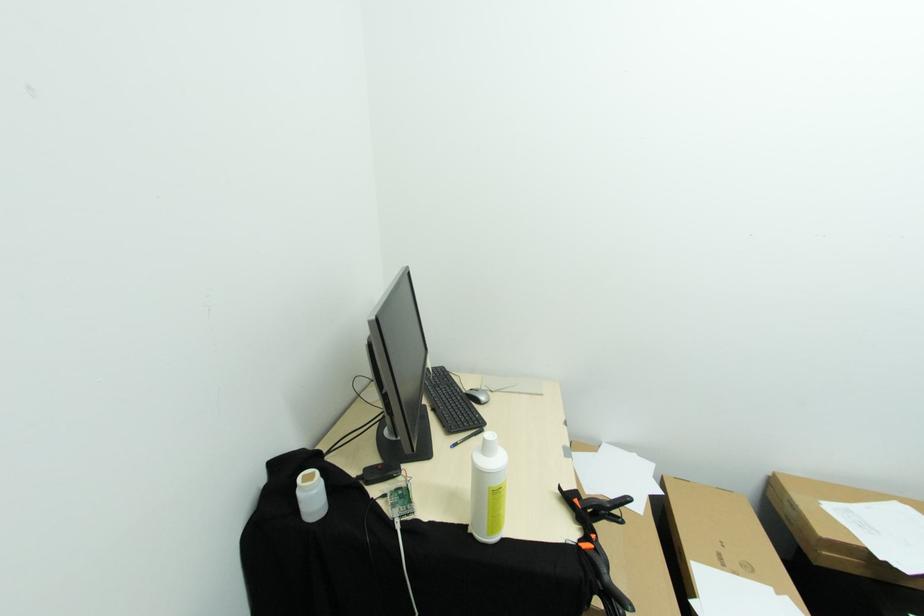
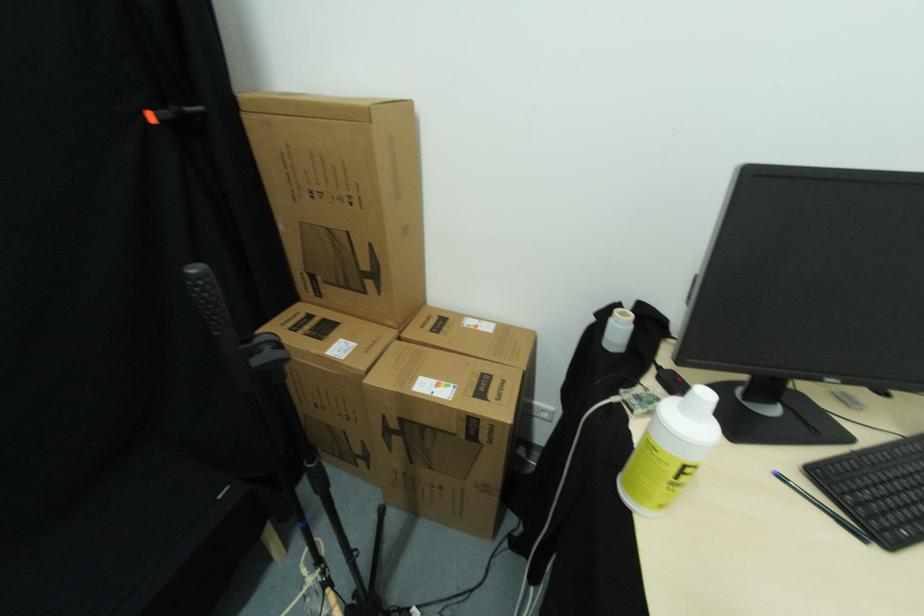
How did the camera likely rotate?

The camera's rotation is toward left-down.